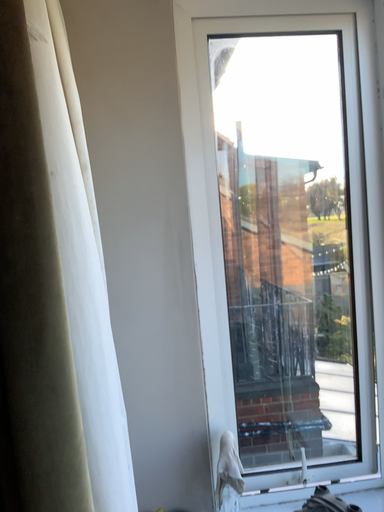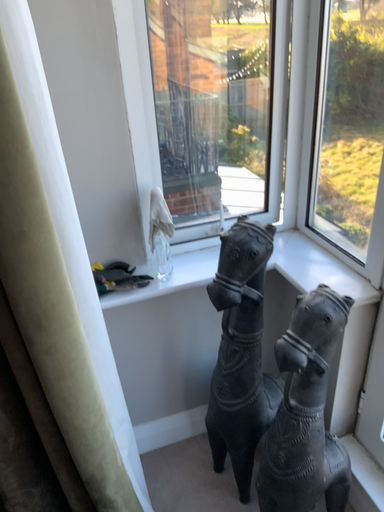
Question: How did the camera likely rotate when shooting the video?

Choices:
 (A) rotated upward
 (B) rotated downward

Answer: (B)